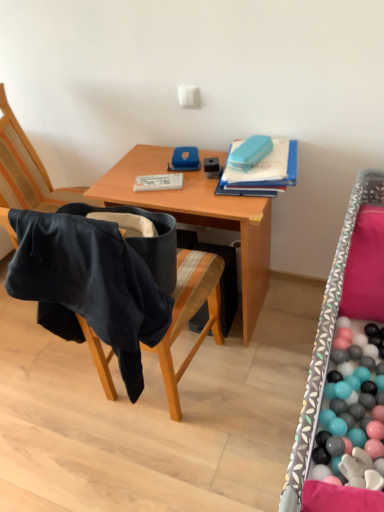
Question: Does blue matte folder at upper right have a greater height compared to black fabric chair at left?

Choices:
 (A) no
 (B) yes

Answer: (A)

Question: Can you confirm if blue matte folder at upper right is positioned to the left of black fabric chair at left?

Choices:
 (A) yes
 (B) no

Answer: (B)

Question: Would you say blue matte folder at upper right is outside black fabric chair at left?

Choices:
 (A) no
 (B) yes

Answer: (B)

Question: Is blue matte folder at upper right wider than black fabric chair at left?

Choices:
 (A) no
 (B) yes

Answer: (A)

Question: Considering the relative positions of blue matte folder at upper right and black fabric chair at left in the image provided, is blue matte folder at upper right in front of black fabric chair at left?

Choices:
 (A) no
 (B) yes

Answer: (A)

Question: From the image's perspective, relative to blue matte folder at upper right, is patterned fabric bed frame at right above or below?

Choices:
 (A) above
 (B) below

Answer: (B)

Question: Does point (311, 367) appear closer or farther from the camera than point (269, 185)?

Choices:
 (A) farther
 (B) closer

Answer: (B)

Question: Is patterned fabric bed frame at right spatially inside blue matte folder at upper right, or outside of it?

Choices:
 (A) outside
 (B) inside

Answer: (A)

Question: In terms of size, does patterned fabric bed frame at right appear bigger or smaller than blue matte folder at upper right?

Choices:
 (A) small
 (B) big

Answer: (B)

Question: Is blue matte folder at upper right spatially inside black fabric chair at left, or outside of it?

Choices:
 (A) inside
 (B) outside

Answer: (B)

Question: From a real-world perspective, relative to black fabric chair at left, is blue matte folder at upper right vertically above or below?

Choices:
 (A) above
 (B) below

Answer: (A)

Question: In terms of size, does blue matte folder at upper right appear bigger or smaller than black fabric chair at left?

Choices:
 (A) big
 (B) small

Answer: (B)

Question: Considering the positions of blue matte folder at upper right and black fabric chair at left in the image, is blue matte folder at upper right taller or shorter than black fabric chair at left?

Choices:
 (A) short
 (B) tall

Answer: (A)

Question: Considering the positions of black fabric chair at left and blue matte folder at upper right in the image, is black fabric chair at left wider or thinner than blue matte folder at upper right?

Choices:
 (A) thin
 (B) wide

Answer: (B)

Question: Do you think black fabric chair at left is within blue matte folder at upper right, or outside of it?

Choices:
 (A) inside
 (B) outside

Answer: (B)